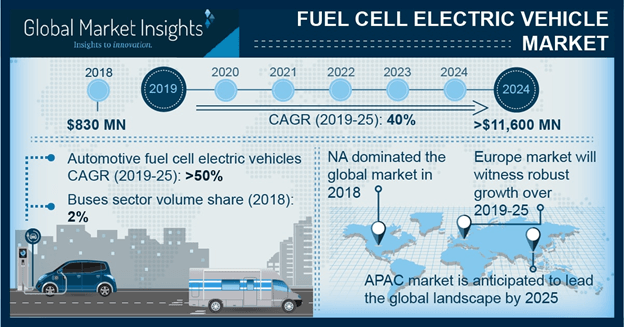
Identify the location of windows. (69, 272), (87, 270), (103, 268), (232, 287), (251, 287), (281, 286).